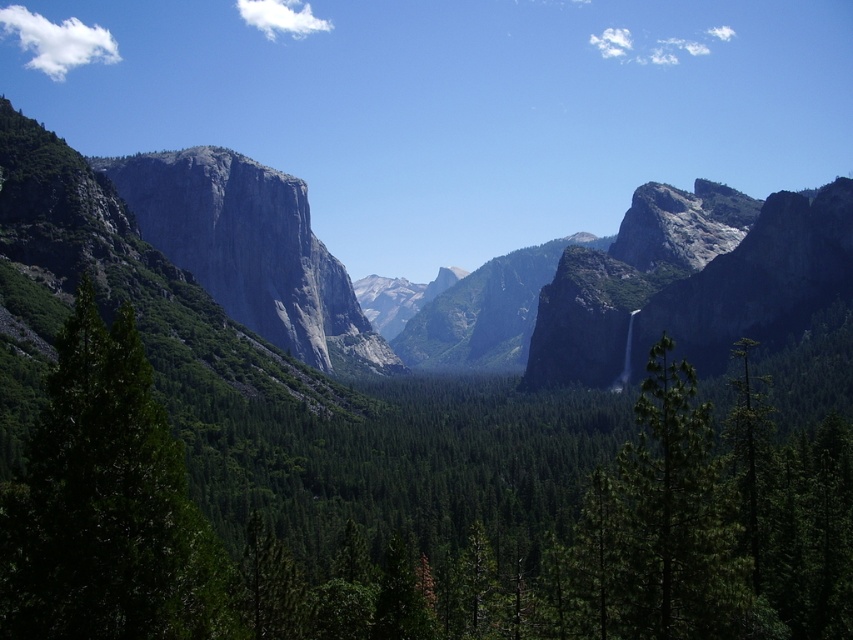
Question: Is green matte tree at center wider than green matte tree at left?

Choices:
 (A) no
 (B) yes

Answer: (B)

Question: Among these points, which one is farthest from the camera?

Choices:
 (A) (605, 595)
 (B) (108, 568)

Answer: (A)

Question: Among these objects, which one is farthest from the camera?

Choices:
 (A) green matte tree at left
 (B) green matte tree at center

Answer: (B)

Question: Can you confirm if green matte tree at center is positioned to the right of green matte tree at left?

Choices:
 (A) no
 (B) yes

Answer: (B)

Question: Which of the following is the closest to the observer?

Choices:
 (A) (194, 604)
 (B) (677, 436)

Answer: (A)

Question: Is green matte tree at center behind green matte tree at left?

Choices:
 (A) yes
 (B) no

Answer: (A)